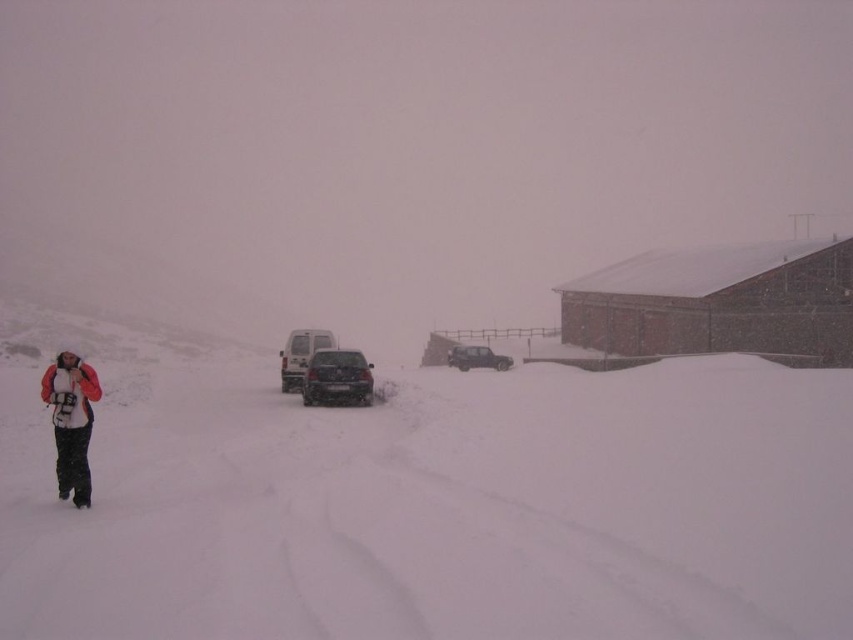
Is point (331, 385) positioned behind point (480, 364)?

No, (331, 385) is closer to viewer.

Is point (352, 401) positioned before point (482, 365)?

Yes.

This screenshot has height=640, width=853. I want to click on satin black suv at center, so click(337, 378).

Between white fluffy snow at lower left and brick red building at right, which one appears on the left side from the viewer's perspective?

From the viewer's perspective, white fluffy snow at lower left appears more on the left side.

Who is more forward, (x=357, y=513) or (x=804, y=342)?

Point (x=357, y=513) is in front.

Find the location of a particular element. This screenshot has height=640, width=853. white fluffy snow at lower left is located at coordinates pos(426,500).

Does white fluffy snow at lower left have a lesser height compared to dark gray matte suv at center?

Incorrect, white fluffy snow at lower left's height does not fall short of dark gray matte suv at center's.

How far apart are white fluffy snow at lower left and dark gray matte suv at center?

white fluffy snow at lower left and dark gray matte suv at center are 19.93 meters apart.

What are the coordinates of `white fluffy snow at lower left` in the screenshot? It's located at (426, 500).

You are a GUI agent. You are given a task and a screenshot of the screen. Output one action in this format:
    pyautogui.click(x=<x>, y=<y>)
    Task: Click on the white fluffy snow at lower left
    
    Given the screenshot: What is the action you would take?
    pyautogui.click(x=426, y=500)